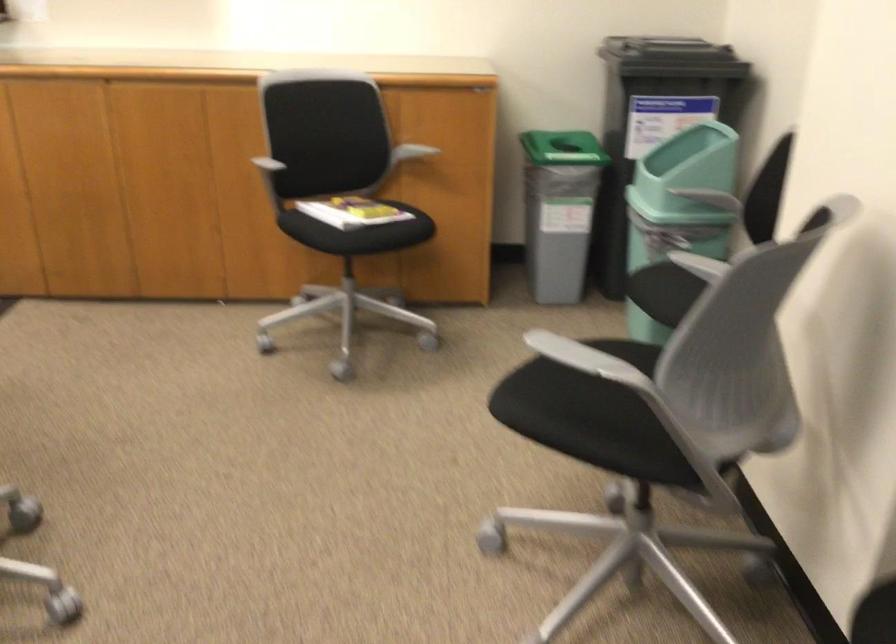
This screenshot has height=644, width=896. I want to click on green bin lid, so click(x=678, y=207).